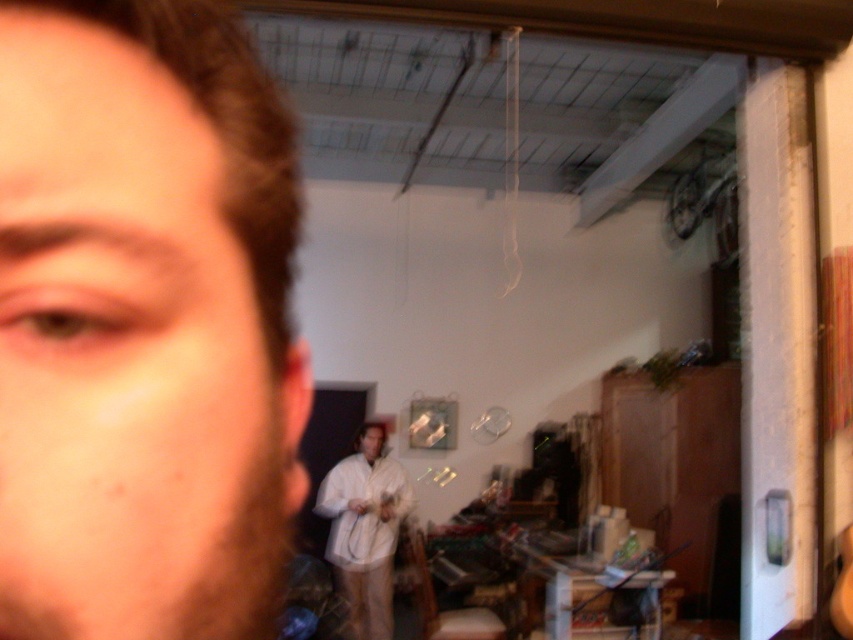
Question: Considering the relative positions of matte skin at center and white matte shirt at center in the image provided, where is matte skin at center located with respect to white matte shirt at center?

Choices:
 (A) right
 (B) left

Answer: (A)

Question: Among these points, which one is farthest from the camera?

Choices:
 (A) (376, 429)
 (B) (117, 618)

Answer: (A)

Question: Is matte skin at center to the left of white matte shirt at center from the viewer's perspective?

Choices:
 (A) no
 (B) yes

Answer: (A)

Question: Which point is closer to the camera?

Choices:
 (A) (344, 480)
 (B) (287, 528)
 (C) (76, 29)

Answer: (C)

Question: Does brown fuzzy beard at lower left have a larger size compared to white matte coat at center?

Choices:
 (A) yes
 (B) no

Answer: (B)

Question: Which is farther from the white matte shirt at center?

Choices:
 (A) white matte coat at center
 (B) brown fuzzy beard at lower left
 (C) matte skin at center

Answer: (C)